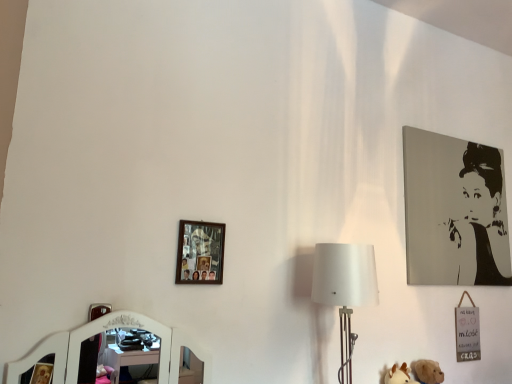
Question: From the image's perspective, is black and white portrait at upper right, the second picture frame in the left-to-right sequence, positioned above or below wooden photo frame at upper left, which is the second picture frame in back-to-front order?

Choices:
 (A) below
 (B) above

Answer: (B)

Question: Is point (438, 236) positioned closer to the camera than point (197, 241)?

Choices:
 (A) farther
 (B) closer

Answer: (A)

Question: Which is nearer to the black and white portrait at upper right, the second picture frame in the left-to-right sequence?

Choices:
 (A) wooden photo frame at upper left, the 1th picture frame in the front-to-back sequence
 (B) white fabric lampshade at center-right

Answer: (B)

Question: Based on their relative distances, which object is nearer to the white fabric lampshade at center-right?

Choices:
 (A) black and white portrait at upper right, positioned as the 1th picture frame in back-to-front order
 (B) wooden photo frame at upper left, arranged as the first picture frame when viewed from the left

Answer: (B)